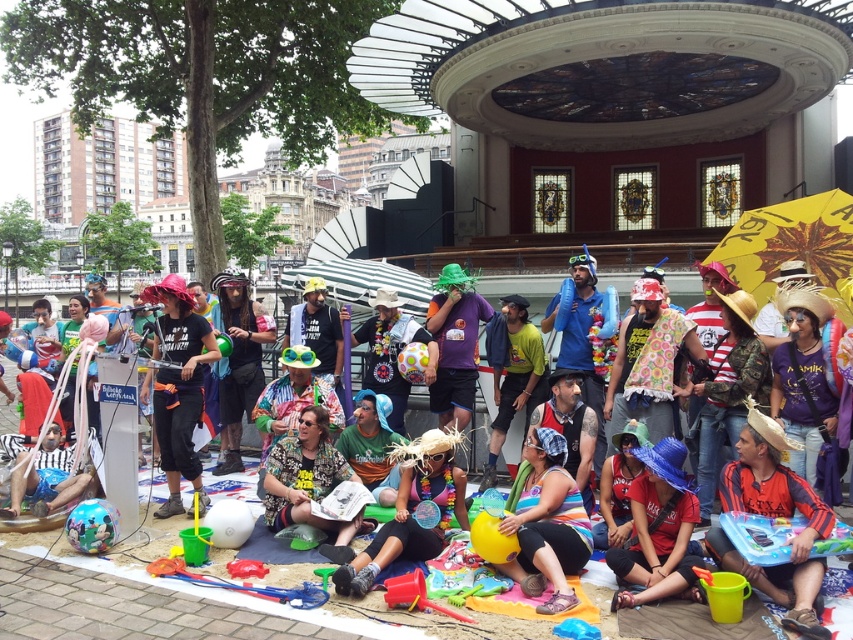
Who is positioned more to the right, printed fabric person at center or red plastic shovel at lower center?

Positioned to the right is red plastic shovel at lower center.

Is point (346, 476) positioned in front of point (402, 602)?

No.

You are a GUI agent. You are given a task and a screenshot of the screen. Output one action in this format:
    pyautogui.click(x=<x>, y=<y>)
    Task: Click on the printed fabric person at center
    
    Given the screenshot: What is the action you would take?
    (308, 481)

Does striped fabric shirt at lower right have a greater width compared to rainbow fabric dress at center?

Correct, the width of striped fabric shirt at lower right exceeds that of rainbow fabric dress at center.

Is the position of striped fabric shirt at lower right less distant than that of rainbow fabric dress at center?

Yes, striped fabric shirt at lower right is closer to the viewer.

The height and width of the screenshot is (640, 853). What are the coordinates of `striped fabric shirt at lower right` in the screenshot? It's located at point(775,516).

Can you confirm if rainbow fabric dress at center is bigger than glossy plastic ball at lower left?

Incorrect, rainbow fabric dress at center is not larger than glossy plastic ball at lower left.

Is rainbow fabric dress at center taller than glossy plastic ball at lower left?

No.

Find the location of a particular element. The height and width of the screenshot is (640, 853). rainbow fabric dress at center is located at coordinates (410, 509).